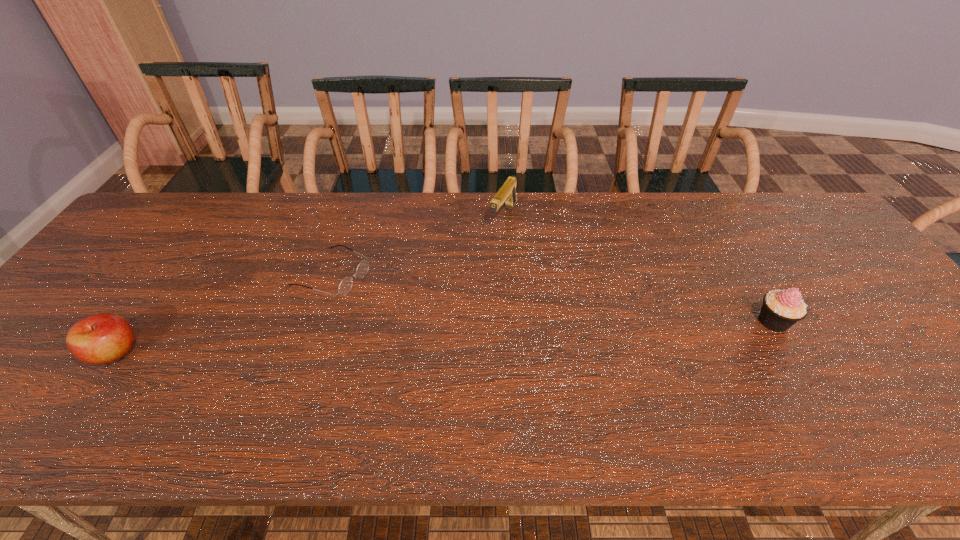
The height and width of the screenshot is (540, 960). I want to click on free space at the left edge, so click(x=142, y=279).

You are a GUI agent. You are given a task and a screenshot of the screen. Output one action in this format:
    pyautogui.click(x=<x>, y=<y>)
    Task: Click on the vacant area at the right edge of the desktop
    The width and height of the screenshot is (960, 540).
    Given the screenshot: What is the action you would take?
    pyautogui.click(x=860, y=264)

The width and height of the screenshot is (960, 540). Identify the location of vacant space at the far right corner of the desktop. [774, 204].

The width and height of the screenshot is (960, 540). In order to click on free region at the near right corner in this screenshot , I will do tap(940, 399).

Find the location of a particular element. Image resolution: width=960 pixels, height=540 pixels. empty location between the second object from left to right and the rightmost object is located at coordinates (553, 298).

The image size is (960, 540). In order to click on free space that is in between the cupcake and the apple in this screenshot , I will do `click(444, 337)`.

At what (x,y) coordinates should I click in order to perform the action: click on free space that is in between the third object from right to left and the pistol. Please return your answer as a coordinate pair (x, y). Looking at the image, I should click on (418, 245).

I want to click on vacant area between the rightmost object and the shortest object, so click(x=553, y=298).

Where is `vacant area that lies between the pistol and the shortest object`? This screenshot has height=540, width=960. vacant area that lies between the pistol and the shortest object is located at coordinates (418, 245).

The height and width of the screenshot is (540, 960). I want to click on vacant area that lies between the leftmost object and the rightmost object, so click(444, 337).